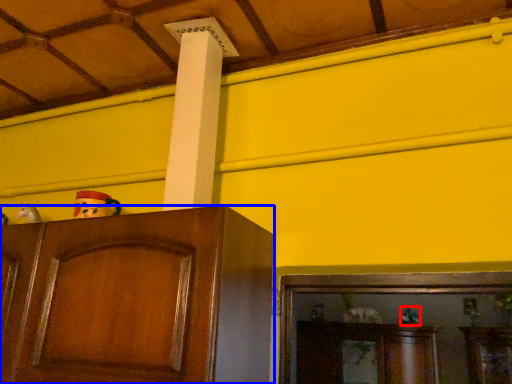
Question: Which point is closer to the camera, toy (highlighted by a red box) or cabinetry (highlighted by a blue box)?

Choices:
 (A) toy
 (B) cabinetry

Answer: (B)